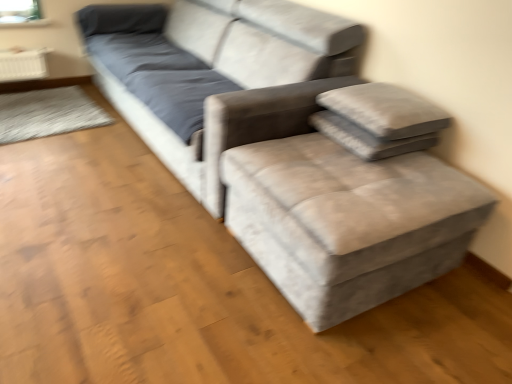
Locate an element on the screen. The image size is (512, 384). vacant space in front of gray fabric pillow at upper right, which appears as the first pillow when ordered from the bottom is located at coordinates (369, 178).